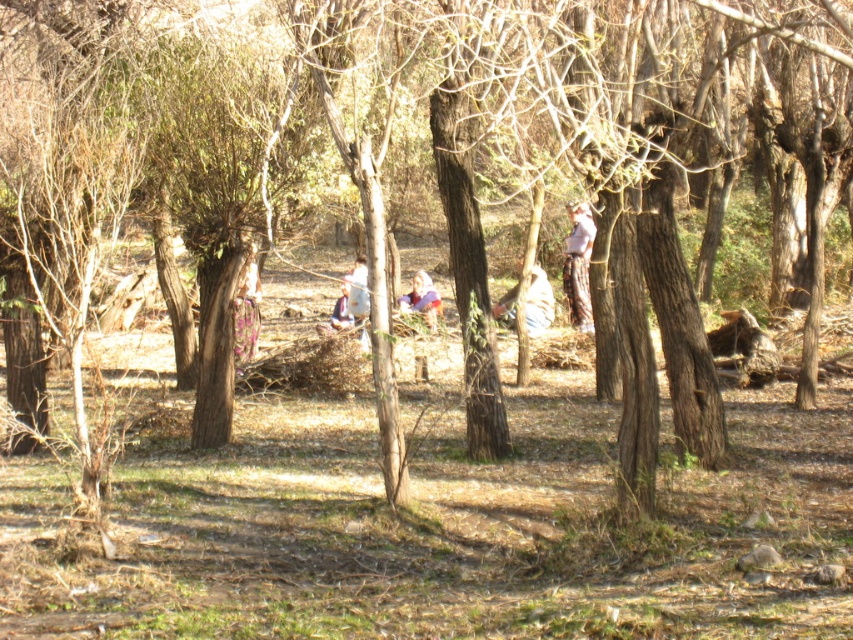
You are standing at the edge of the forest and notice a person wearing light brown fabric pants at center. Based on their position, can you estimate how far they are from the center of the forest?

The light brown fabric pants at center is located at point (578, 266), which means they are relatively close to the center of the forest.

You are standing in the forest and see both the floral fabric dress at center and the light blue fabric at center. Which one is nearer to you?

The floral fabric dress at center is closer to the viewer than the light blue fabric at center.

Based on the photo, you are a hiker who needs to reach a water source located at the edge of the forest. You see the light brown fabric pants at center and the white fabric cloth at center in your path. Can you walk through the gap between them without needing to detour?

The distance between the light brown fabric pants at center and the white fabric cloth at center is 13.07 feet, which is more than enough space for a hiker to walk through without needing to detour.